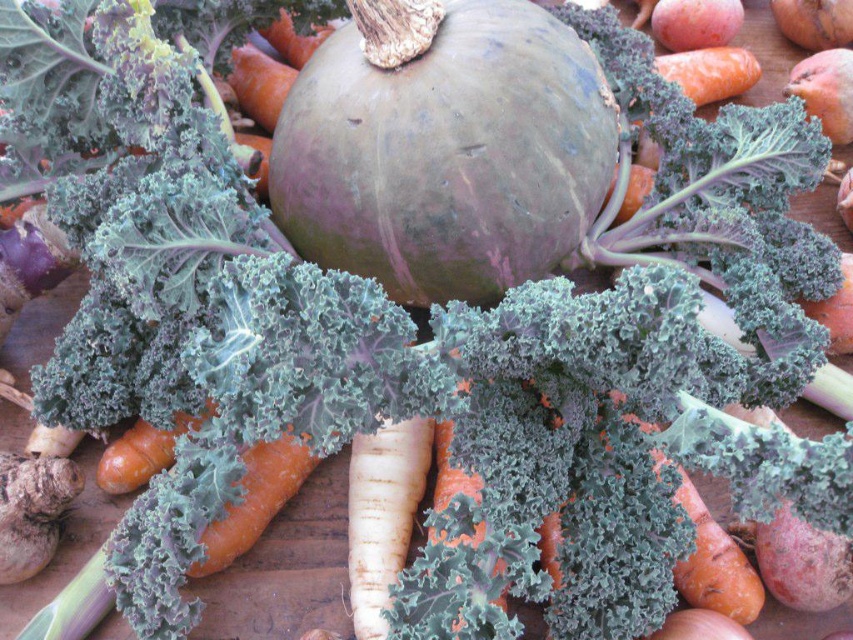
Question: Considering the relative positions of orange matte carrot at center and orange smooth carrot at center in the image provided, where is orange matte carrot at center located with respect to orange smooth carrot at center?

Choices:
 (A) below
 (B) above

Answer: (A)

Question: Which point is closer to the camera?

Choices:
 (A) orange matte carrot at center
 (B) smooth brown onion at lower right

Answer: (A)

Question: Is the position of orange smooth carrot at center less distant than that of smooth brown onion at lower right?

Choices:
 (A) no
 (B) yes

Answer: (A)

Question: Can you confirm if orange matte carrot at center is wider than smooth brown onion at lower right?

Choices:
 (A) yes
 (B) no

Answer: (A)

Question: Which point appears closest to the camera in this image?

Choices:
 (A) (724, 627)
 (B) (747, 614)

Answer: (A)

Question: Among these points, which one is farthest from the camera?

Choices:
 (A) (248, 86)
 (B) (668, 618)
 (C) (747, 580)

Answer: (A)